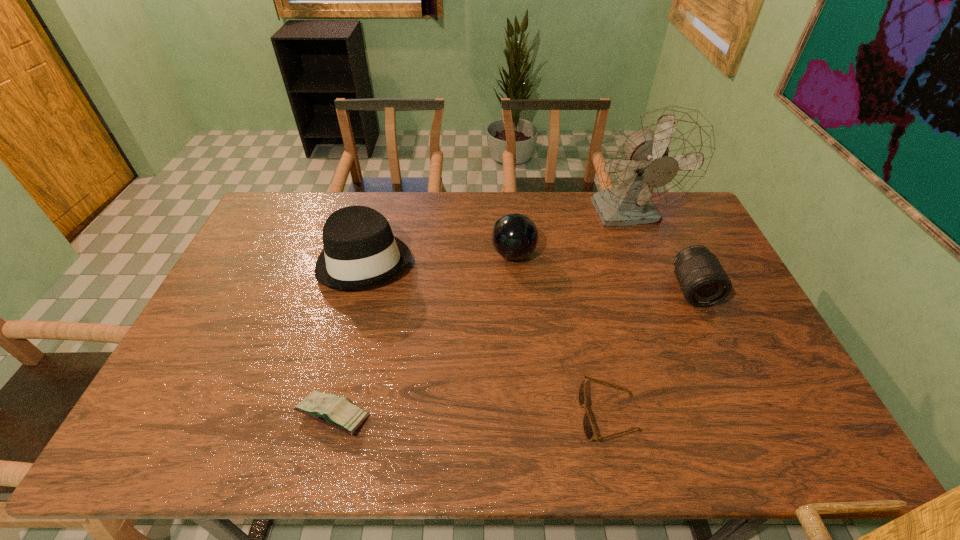
Locate an element on the screen. diary that is positioned at the near edge is located at coordinates (338, 412).

At what (x,y) coordinates should I click in order to perform the action: click on fan at the right edge. Please return your answer as a coordinate pair (x, y). The width and height of the screenshot is (960, 540). Looking at the image, I should click on (658, 158).

The image size is (960, 540). Identify the location of telephoto lens located in the right edge section of the desktop. (703, 281).

Where is `object situated at the far right corner`? Image resolution: width=960 pixels, height=540 pixels. object situated at the far right corner is located at coordinates (658, 158).

The height and width of the screenshot is (540, 960). I want to click on vacant space at the far edge of the desktop, so click(x=459, y=195).

Where is `vacant space at the near edge`? Image resolution: width=960 pixels, height=540 pixels. vacant space at the near edge is located at coordinates (444, 446).

Image resolution: width=960 pixels, height=540 pixels. Find the location of `free region at the left edge of the desktop`. free region at the left edge of the desktop is located at coordinates (224, 311).

The height and width of the screenshot is (540, 960). I want to click on vacant space at the right edge of the desktop, so click(x=697, y=235).

Where is `free space between the diary and the fedora`? The height and width of the screenshot is (540, 960). free space between the diary and the fedora is located at coordinates (348, 338).

You are a GUI agent. You are given a task and a screenshot of the screen. Output one action in this format:
    pyautogui.click(x=<x>, y=<y>)
    Task: Click on the vacant space that's between the fifth shortest object and the sunglasses
    
    Given the screenshot: What is the action you would take?
    pyautogui.click(x=487, y=338)